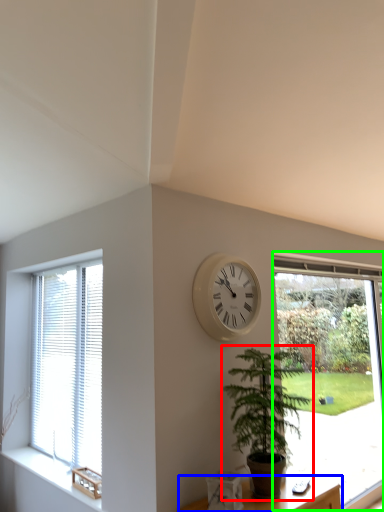
Question: Based on their relative distances, which object is nearer to houseplant (highlighted by a red box)? Choose from furniture (highlighted by a blue box) and window (highlighted by a green box).

Choices:
 (A) furniture
 (B) window

Answer: (A)